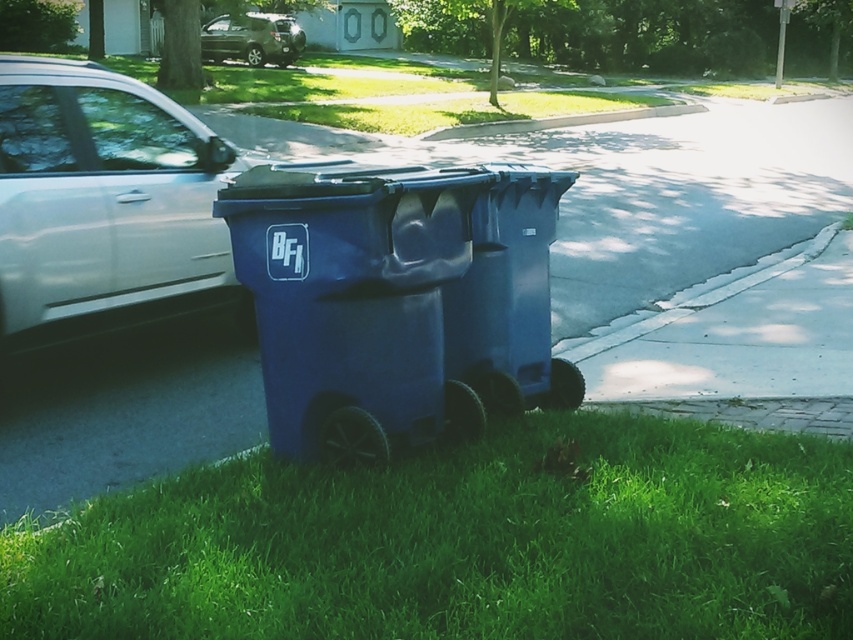
Question: From the image, what is the correct spatial relationship of green grass at lower center in relation to satin silver suv at upper center?

Choices:
 (A) left
 (B) right

Answer: (B)

Question: Can you confirm if green grass at lower center is bigger than satin silver suv at upper center?

Choices:
 (A) no
 (B) yes

Answer: (A)

Question: Can you confirm if green grass at lower center is positioned to the left of blue plastic trash can at center?

Choices:
 (A) no
 (B) yes

Answer: (A)

Question: Which object appears closest to the camera in this image?

Choices:
 (A) satin silver car at left
 (B) satin silver suv at upper center
 (C) blue plastic trash can at center
 (D) green grass at lower center

Answer: (D)

Question: Which object is the farthest from the green grass at lower center?

Choices:
 (A) blue plastic trash can at center
 (B) satin silver car at left

Answer: (B)

Question: Which point is closer to the camera?

Choices:
 (A) green grass at lower center
 (B) blue plastic trash can at center
 (C) satin silver car at left
 (D) satin silver suv at upper center

Answer: (A)